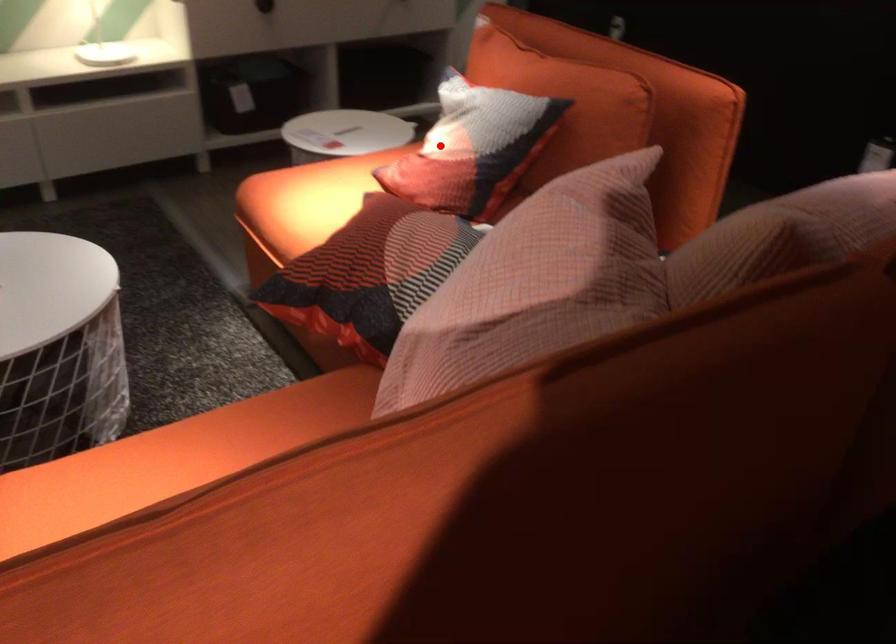
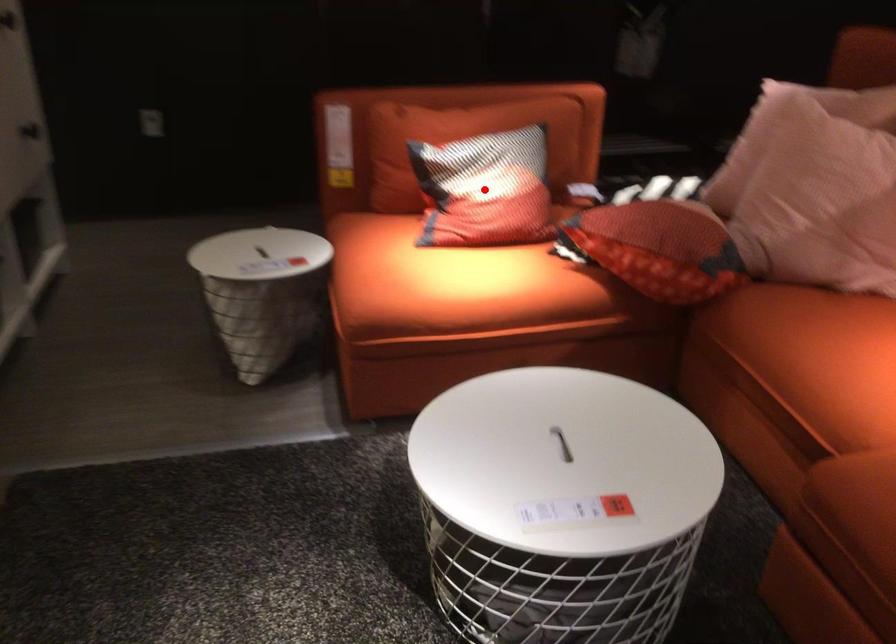
I am providing you with two images of the same scene from different viewpoints. A red point is marked on the first image and another point is marked on the second image. Are the points marked in image1 and image2 representing the same 3D position?

Yes